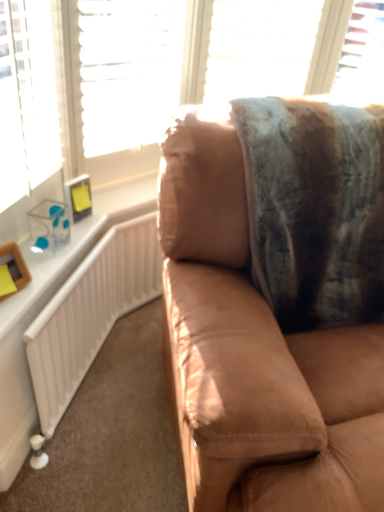
Question: Is fuzzy woolen blanket at upper right oriented away from suede brown couch at center?

Choices:
 (A) yes
 (B) no

Answer: (A)

Question: Does fuzzy woolen blanket at upper right turn towards suede brown couch at center?

Choices:
 (A) no
 (B) yes

Answer: (B)

Question: From a real-world perspective, is fuzzy woolen blanket at upper right positioned over suede brown couch at center based on gravity?

Choices:
 (A) yes
 (B) no

Answer: (A)

Question: From the image's perspective, is fuzzy woolen blanket at upper right located above suede brown couch at center?

Choices:
 (A) yes
 (B) no

Answer: (A)

Question: Can you confirm if fuzzy woolen blanket at upper right is smaller than suede brown couch at center?

Choices:
 (A) yes
 (B) no

Answer: (A)

Question: Does fuzzy woolen blanket at upper right come in front of suede brown couch at center?

Choices:
 (A) no
 (B) yes

Answer: (A)

Question: Can we say white textured blind at upper center lies outside transparent plastic window at upper right?

Choices:
 (A) no
 (B) yes

Answer: (B)

Question: Is transparent plastic window at upper right surrounded by white textured blind at upper center?

Choices:
 (A) yes
 (B) no

Answer: (B)

Question: From the image's perspective, is white textured blind at upper center located above transparent plastic window at upper right?

Choices:
 (A) no
 (B) yes

Answer: (A)

Question: Is white textured blind at upper center smaller than transparent plastic window at upper right?

Choices:
 (A) yes
 (B) no

Answer: (B)

Question: Are white textured blind at upper center and transparent plastic window at upper right far apart?

Choices:
 (A) no
 (B) yes

Answer: (A)

Question: Is white textured blind at upper center to the left of transparent plastic window at upper right from the viewer's perspective?

Choices:
 (A) no
 (B) yes

Answer: (B)

Question: From the image's perspective, does white textured blind at upper center appear lower than white glossy radiator at left?

Choices:
 (A) yes
 (B) no

Answer: (B)